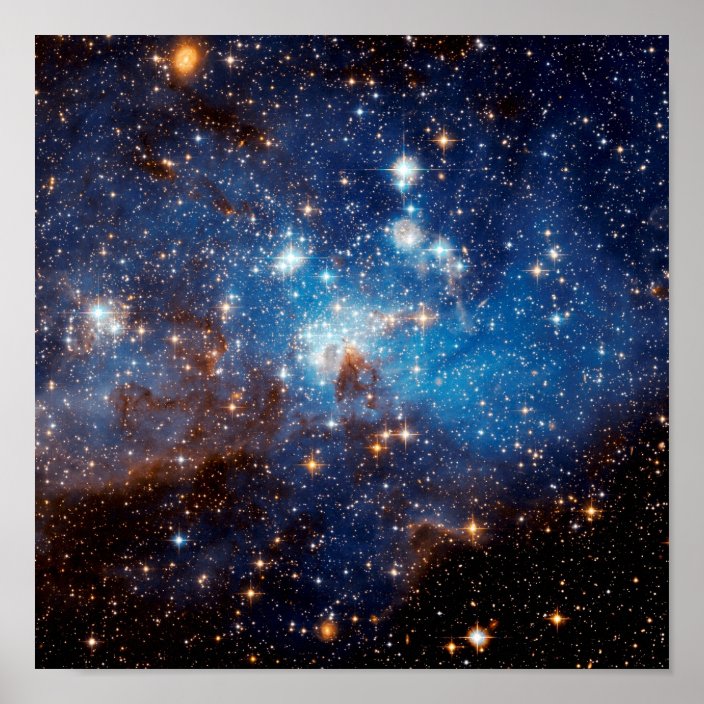
The width and height of the screenshot is (704, 704). Find the location of `artwork`. artwork is located at coordinates (615, 536).